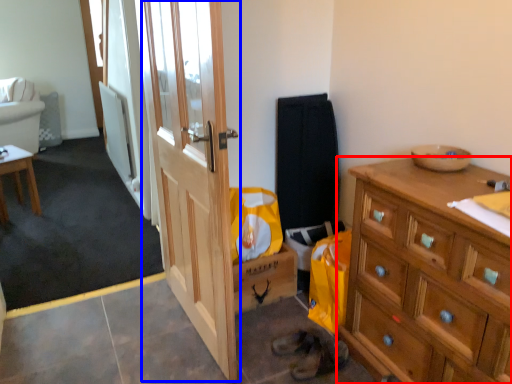
Question: Which object is further to the camera taking this photo, cabinetry (highlighted by a red box) or door (highlighted by a blue box)?

Choices:
 (A) cabinetry
 (B) door

Answer: (B)